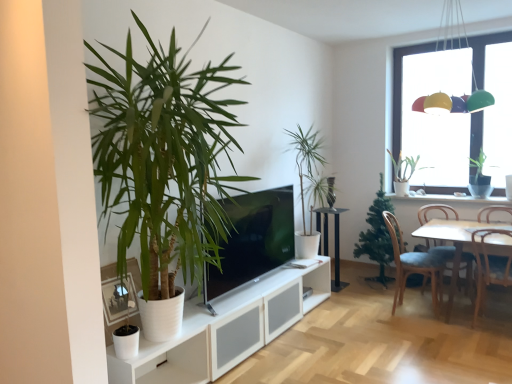
The width and height of the screenshot is (512, 384). Identify the location of vacant region in front of blue fabric chair at lower right, which is the fourth chair from right to left. (428, 329).